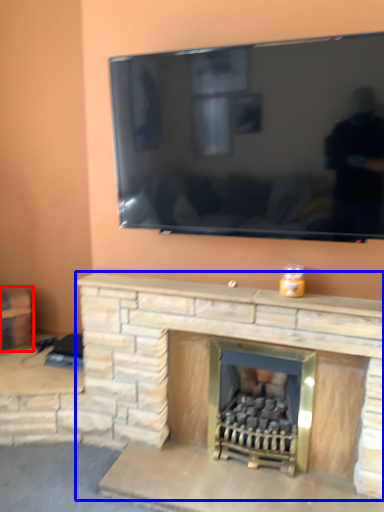
Question: Which of the following is the farthest to the observer, furniture (highlighted by a red box) or fireplace (highlighted by a blue box)?

Choices:
 (A) furniture
 (B) fireplace

Answer: (A)